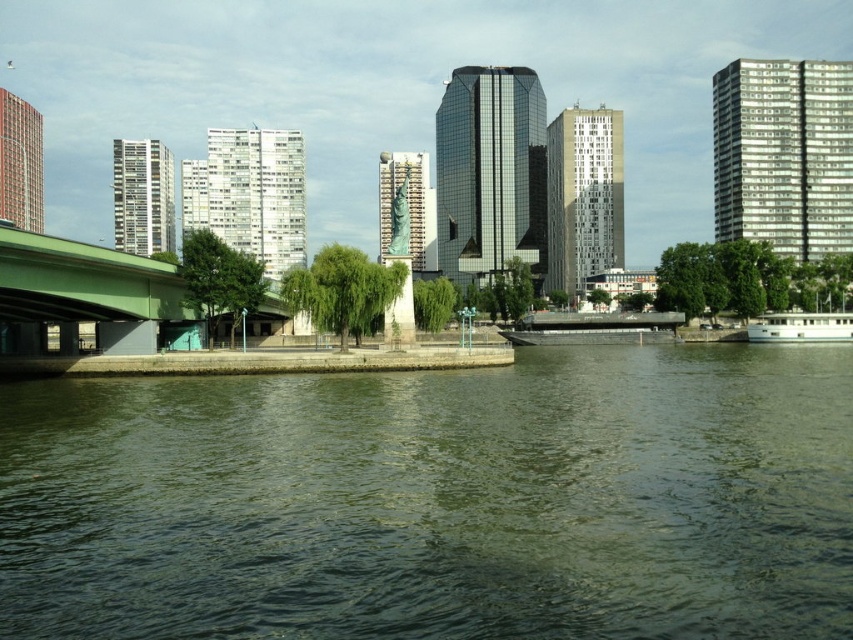
You are a tourist standing on the green bridge on the left side of the image. You want to take a photo of the white smooth building at center and the green water at center in the same frame. Based on their heights, will both objects be fully visible in the photo?

The green water at center is shorter than the white smooth building at center. Since the water is lower, it will be visible, but the building is taller, so it might be partially visible depending on the camera angle. However, both can likely be captured in the same frame if the camera is positioned to include both.

You are a tourist standing at the waterfront and want to take a photo that includes both the white textured building at left and the bronze statue at center. Based on their positions, which object should you frame first in your camera viewfinder to ensure both are captured in the shot?

The white textured building at left is positioned on the left side of the bronze statue at center, so you should frame the white textured building at left first to ensure both are captured in the shot.

You are a photographer planning to capture the waterfront scene. You want to ensure both the green water at center and the white glass building at upper right are visible in your shot. Given their sizes, which object should you frame closer to the center of your photo to balance the composition?

The green water at center is smaller in size compared to the white glass building at upper right. To balance the composition, you should frame the larger white glass building at upper right closer to the center of your photo since it has a more significant visual weight due to its size.